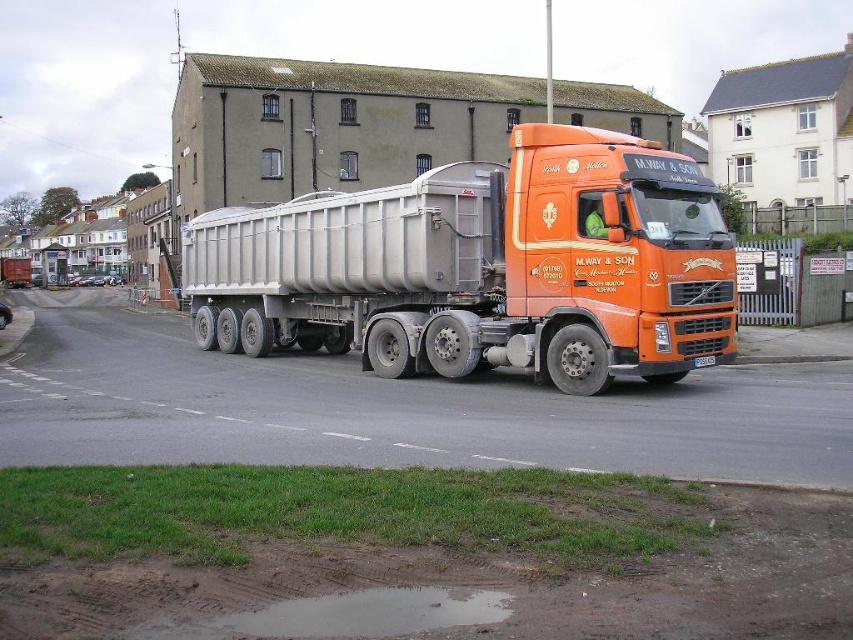
Based on the photo, does orange matte truck at center have a greater height compared to muddy water at lower center?

Indeed, orange matte truck at center has a greater height compared to muddy water at lower center.

Which of these two, orange matte truck at center or muddy water at lower center, stands taller?

orange matte truck at center

Is point (408, 268) positioned in front of point (459, 625)?

No, it is not.

Where is `orange matte truck at center`? The height and width of the screenshot is (640, 853). orange matte truck at center is located at coordinates (485, 266).